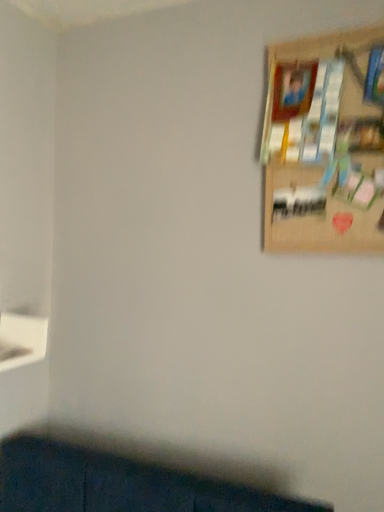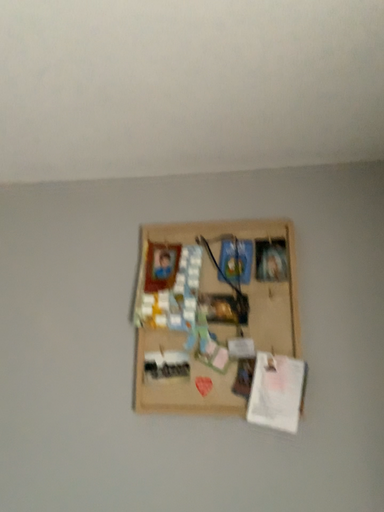
Question: Which way did the camera rotate in the video?

Choices:
 (A) rotated right
 (B) rotated left

Answer: (A)